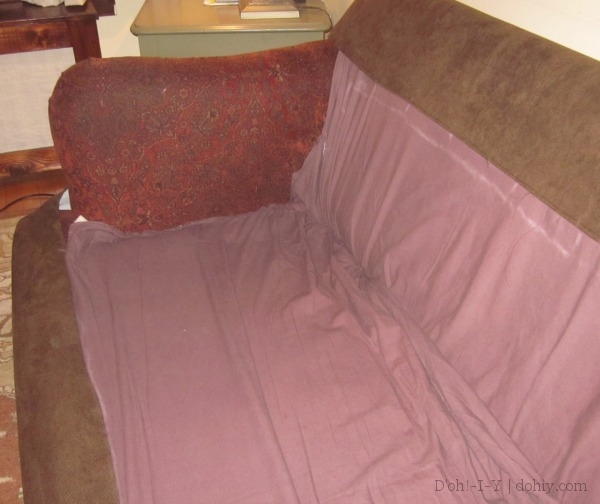
You are a GUI agent. You are given a task and a screenshot of the screen. Output one action in this format:
    pyautogui.click(x=<x>, y=<y>)
    Task: Click on the couch
    The width and height of the screenshot is (600, 504).
    Given the screenshot: What is the action you would take?
    pyautogui.click(x=217, y=138), pyautogui.click(x=513, y=114), pyautogui.click(x=74, y=454)